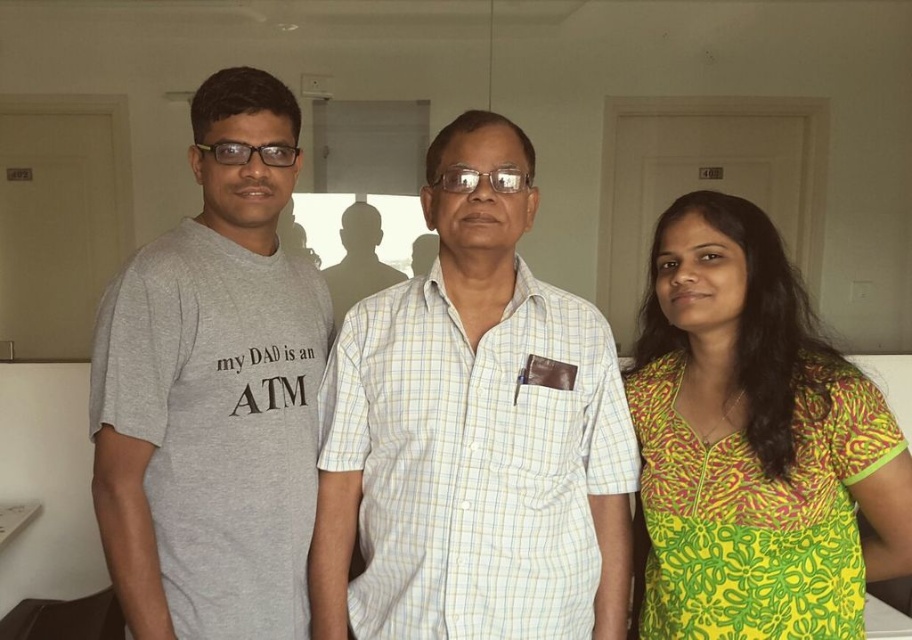
Which is in front, point (141, 636) or point (385, 269)?

Positioned in front is point (141, 636).

Between gray cotton t-shirt at left and silhouette of person at center, which one appears on the right side from the viewer's perspective?

gray cotton t-shirt at left

Locate an element on the screen. Image resolution: width=912 pixels, height=640 pixels. gray cotton t-shirt at left is located at coordinates (213, 390).

Based on the photo, which is more to the right, gray cotton t-shirt at left or printed cotton dress at right?

printed cotton dress at right

Based on the photo, is gray cotton t-shirt at left in front of printed cotton dress at right?

No, gray cotton t-shirt at left is behind printed cotton dress at right.

Does point (161, 237) come closer to viewer compared to point (676, 266)?

Yes, it is in front of point (676, 266).

The height and width of the screenshot is (640, 912). I want to click on gray cotton t-shirt at left, so click(x=213, y=390).

Is yellow checkered shirt at center shorter than printed cotton dress at right?

No.

Which is below, yellow checkered shirt at center or printed cotton dress at right?

Positioned lower is printed cotton dress at right.

Is point (338, 497) farther from camera compared to point (855, 483)?

Yes.

What are the coordinates of `yellow checkered shirt at center` in the screenshot? It's located at (473, 433).